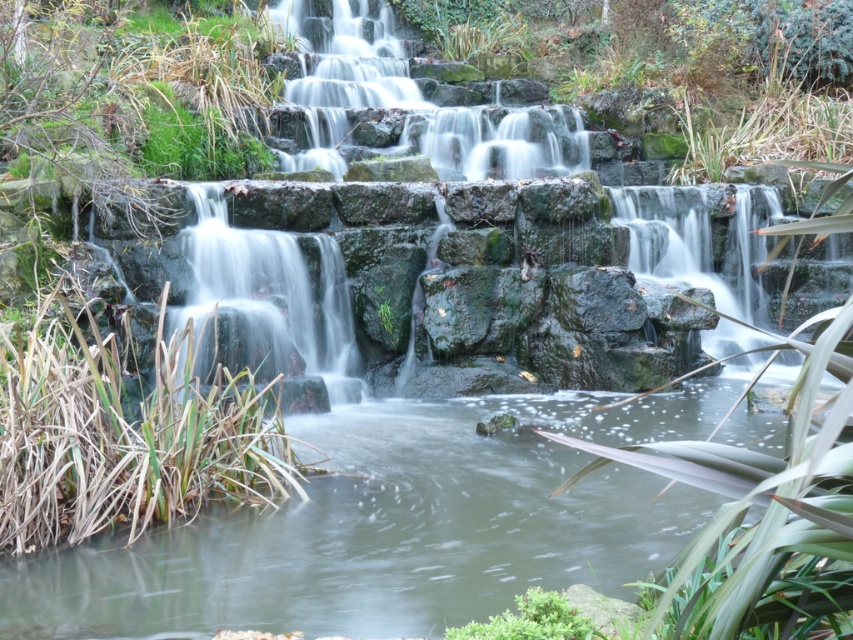
Question: Which point is closer to the camera?

Choices:
 (A) (531, 148)
 (B) (578, 560)

Answer: (B)

Question: Is clear water at center below green mossy rock at upper center?

Choices:
 (A) no
 (B) yes

Answer: (B)

Question: Is clear water at center to the left of green mossy rock at upper center from the viewer's perspective?

Choices:
 (A) no
 (B) yes

Answer: (A)

Question: Which object is closer to the camera taking this photo?

Choices:
 (A) clear water at center
 (B) green mossy rock at upper center

Answer: (A)

Question: Is clear water at center closer to camera compared to green mossy rock at upper center?

Choices:
 (A) yes
 (B) no

Answer: (A)